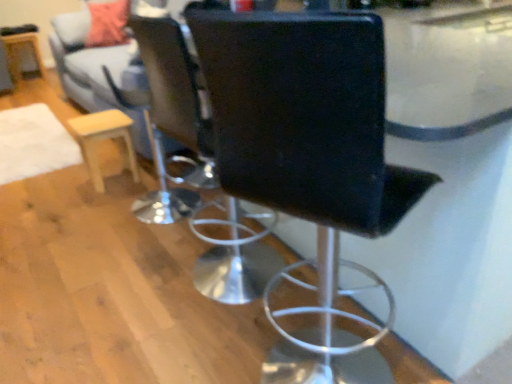
Image resolution: width=512 pixels, height=384 pixels. Identify the location of vacant area located to the right-hand side of light wood/finely finished stool at left. (144, 182).